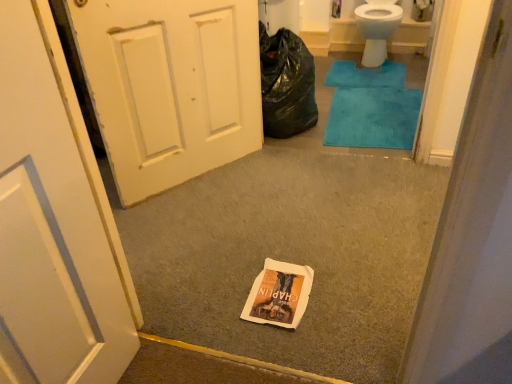
In order to click on white painted wood door at left in this screenshot , I will do `click(170, 86)`.

Image resolution: width=512 pixels, height=384 pixels. Describe the element at coordinates (377, 28) in the screenshot. I see `white glossy porcelain toilet at upper right` at that location.

The image size is (512, 384). I want to click on white paper bag at center, so click(279, 294).

From the image's perspective, does blue plush bath mat at upper right, the first bath mat in the back-to-front sequence, appear higher than white painted wood door at left?

Yes, from the image's perspective, blue plush bath mat at upper right, the first bath mat in the back-to-front sequence, is above white painted wood door at left.

Is blue plush bath mat at upper right, positioned as the second bath mat in bottom-to-top order, spatially inside white painted wood door at left, or outside of it?

blue plush bath mat at upper right, positioned as the second bath mat in bottom-to-top order, lies outside white painted wood door at left.

Measure the distance from blue plush bath mat at upper right, positioned as the second bath mat in bottom-to-top order, to white painted wood door at left.

blue plush bath mat at upper right, positioned as the second bath mat in bottom-to-top order, is 4.87 feet from white painted wood door at left.

Which object is positioned more to the left, blue plush bath mat at upper right, the first bath mat in the back-to-front sequence, or white painted wood door at left?

From the viewer's perspective, white painted wood door at left appears more on the left side.

Considering the relative positions of white painted wood door at left and white paper bag at center in the image provided, is white painted wood door at left to the left of white paper bag at center from the viewer's perspective?

Indeed, white painted wood door at left is positioned on the left side of white paper bag at center.

Where is `door that appears on the left of white paper bag at center`? This screenshot has height=384, width=512. door that appears on the left of white paper bag at center is located at coordinates [170, 86].

From the image's perspective, does white painted wood door at left appear lower than white paper bag at center?

Actually, white painted wood door at left appears above white paper bag at center in the image.

Is point (376, 38) positioned before point (389, 130)?

That is False.

From the image's perspective, is white glossy porcelain toilet at upper right located beneath teal plush bath mat at center, acting as the first bath mat starting from the bottom?

No, from the image's perspective, white glossy porcelain toilet at upper right is not below teal plush bath mat at center, acting as the first bath mat starting from the bottom.

Is white glossy porcelain toilet at upper right with teal plush bath mat at center, acting as the first bath mat starting from the bottom?

No, white glossy porcelain toilet at upper right is not next to teal plush bath mat at center, acting as the first bath mat starting from the bottom.

From the picture: Is teal plush bath mat at center, positioned as the first bath mat in front-to-back order, completely or partially inside white glossy porcelain toilet at upper right?

No, teal plush bath mat at center, positioned as the first bath mat in front-to-back order, is not inside white glossy porcelain toilet at upper right.

Considering the positions of point (273, 224) and point (368, 71), is point (273, 224) closer or farther from the camera than point (368, 71)?

Clearly, point (273, 224) is closer to the camera than point (368, 71).

Are white paper bag at center and blue plush bath mat at upper right, which is counted as the first bath mat, starting from the top, located far from each other?

Yes, white paper bag at center is far from blue plush bath mat at upper right, which is counted as the first bath mat, starting from the top.

Could you tell me if white paper bag at center is facing blue plush bath mat at upper right, which is counted as the first bath mat, starting from the top?

No, white paper bag at center is not turned towards blue plush bath mat at upper right, which is counted as the first bath mat, starting from the top.

How many degrees apart are the facing directions of blue plush bath mat at upper right, the 2th bath mat positioned from the front, and teal plush bath mat at center, the second bath mat viewed from the top?

blue plush bath mat at upper right, the 2th bath mat positioned from the front, and teal plush bath mat at center, the second bath mat viewed from the top, are facing 3 degrees away from each other.

From the picture: Based on their positions, is blue plush bath mat at upper right, positioned as the second bath mat in bottom-to-top order, located to the left or right of teal plush bath mat at center, positioned as the first bath mat in front-to-back order?

From the image, it's evident that blue plush bath mat at upper right, positioned as the second bath mat in bottom-to-top order, is to the right of teal plush bath mat at center, positioned as the first bath mat in front-to-back order.

Which point is more forward, (347, 82) or (410, 102)?

The point (410, 102) is closer to the camera.

Where is `bath mat located in front of the blue plush bath mat at upper right, which is counted as the first bath mat, starting from the top`? bath mat located in front of the blue plush bath mat at upper right, which is counted as the first bath mat, starting from the top is located at coordinates [x=371, y=107].

Considering the relative sizes of teal plush bath mat at center, the second bath mat viewed from the top, and blue plush bath mat at upper right, the 2th bath mat positioned from the front, in the image provided, is teal plush bath mat at center, the second bath mat viewed from the top, thinner than blue plush bath mat at upper right, the 2th bath mat positioned from the front,?

Incorrect, the width of teal plush bath mat at center, the second bath mat viewed from the top, is not less than that of blue plush bath mat at upper right, the 2th bath mat positioned from the front.

Which object is further away from the camera, teal plush bath mat at center, positioned as the first bath mat in front-to-back order, or blue plush bath mat at upper right, positioned as the second bath mat in bottom-to-top order?

blue plush bath mat at upper right, positioned as the second bath mat in bottom-to-top order, is further from the camera.

Who is bigger, teal plush bath mat at center, positioned as the first bath mat in front-to-back order, or blue plush bath mat at upper right, which is counted as the first bath mat, starting from the top?

Bigger between the two is teal plush bath mat at center, positioned as the first bath mat in front-to-back order.

Considering the positions of point (396, 132) and point (291, 313), is point (396, 132) closer or farther from the camera than point (291, 313)?

Point (396, 132) is farther from the camera than point (291, 313).

In the scene shown: Can you tell me how much teal plush bath mat at center, acting as the 2th bath mat starting from the back, and white paper bag at center differ in facing direction?

174 degrees.

Who is shorter, teal plush bath mat at center, acting as the 2th bath mat starting from the back, or white paper bag at center?

white paper bag at center.

In the scene shown: Looking at the image, does teal plush bath mat at center, positioned as the first bath mat in front-to-back order, seem bigger or smaller compared to white paper bag at center?

In the image, teal plush bath mat at center, positioned as the first bath mat in front-to-back order, appears to be larger than white paper bag at center.

At what (x,y) coordinates should I click in order to perform the action: click on the 2nd bath mat behind the white painted wood door at left. Please return your answer as a coordinate pair (x, y). The height and width of the screenshot is (384, 512). Looking at the image, I should click on (366, 75).

The width and height of the screenshot is (512, 384). In order to click on door on the left of white paper bag at center in this screenshot , I will do `click(170, 86)`.

From the image, which object appears to be farther from white glossy porcelain toilet at upper right, white paper bag at center or blue plush bath mat at upper right, which is counted as the first bath mat, starting from the top?

white paper bag at center is positioned further to the anchor white glossy porcelain toilet at upper right.

Looking at the image, which one is located closer to white painted wood door at left, black plastic bag at upper right or teal plush bath mat at center, acting as the 2th bath mat starting from the back?

Among the two, black plastic bag at upper right is located nearer to white painted wood door at left.

Which object lies further to the anchor point blue plush bath mat at upper right, the first bath mat in the back-to-front sequence, white paper bag at center or white paper bag at center?

white paper bag at center is further to blue plush bath mat at upper right, the first bath mat in the back-to-front sequence.

From the image, which object appears to be farther from white paper bag at center, black plastic bag at upper right or blue plush bath mat at upper right, which is counted as the first bath mat, starting from the top?

blue plush bath mat at upper right, which is counted as the first bath mat, starting from the top, lies further to white paper bag at center than the other object.

Which object lies further to the anchor point white paper bag at center, white glossy porcelain toilet at upper right or teal plush bath mat at center, acting as the 2th bath mat starting from the back?

white glossy porcelain toilet at upper right is further to white paper bag at center.

Based on their spatial positions, is white paper bag at center or white paper bag at center further from black plastic bag at upper right?

white paper bag at center lies further to black plastic bag at upper right than the other object.

Considering their positions, is blue plush bath mat at upper right, positioned as the second bath mat in bottom-to-top order, positioned closer to black plastic bag at upper right than white glossy porcelain toilet at upper right?

blue plush bath mat at upper right, positioned as the second bath mat in bottom-to-top order, is closer to black plastic bag at upper right.

When comparing their distances from white paper bag at center, does black plastic bag at upper right or white paper bag at center seem closer?

Based on the image, white paper bag at center appears to be nearer to white paper bag at center.

This screenshot has height=384, width=512. What are the coordinates of `bath mat between black plastic bag at upper right and blue plush bath mat at upper right, the first bath mat in the back-to-front sequence, in the front-back direction` in the screenshot? It's located at (371, 107).

Identify the location of door between black plastic bag at upper right and white paper bag at center from top to bottom. The height and width of the screenshot is (384, 512). 170,86.

Where is `bath mat between white paper bag at center and blue plush bath mat at upper right, positioned as the second bath mat in bottom-to-top order, along the z-axis`? This screenshot has height=384, width=512. bath mat between white paper bag at center and blue plush bath mat at upper right, positioned as the second bath mat in bottom-to-top order, along the z-axis is located at coordinates (371, 107).

Locate an element on the screen. The width and height of the screenshot is (512, 384). door between white paper bag at center and teal plush bath mat at center, the second bath mat viewed from the top, from front to back is located at coordinates (170, 86).